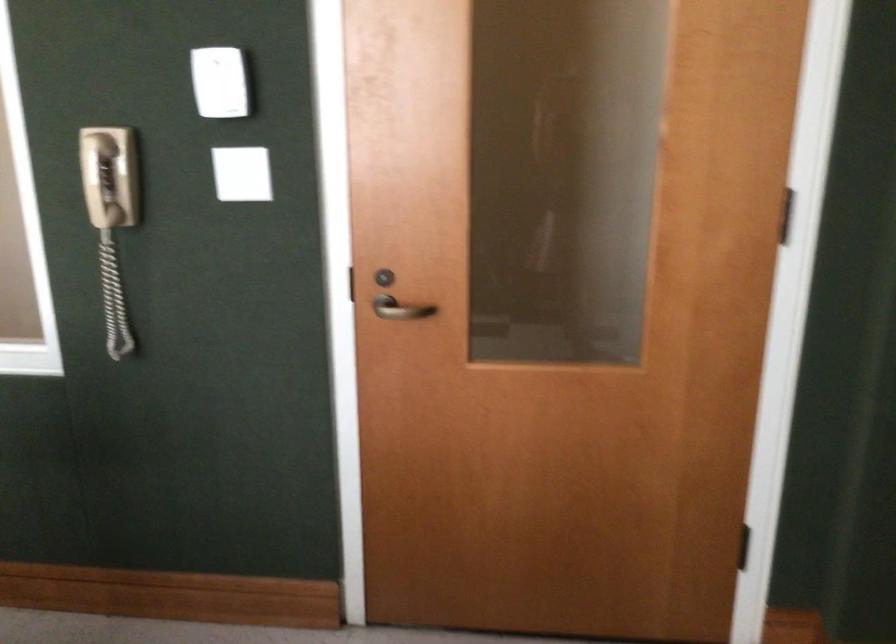
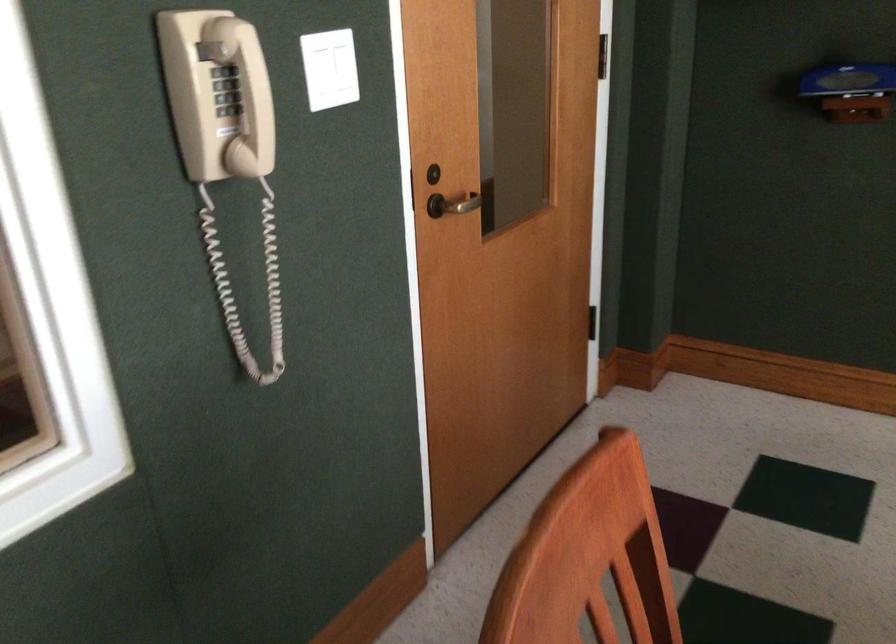
Where in the second image is the point corresponding to point 89,187 from the first image?

(245, 95)